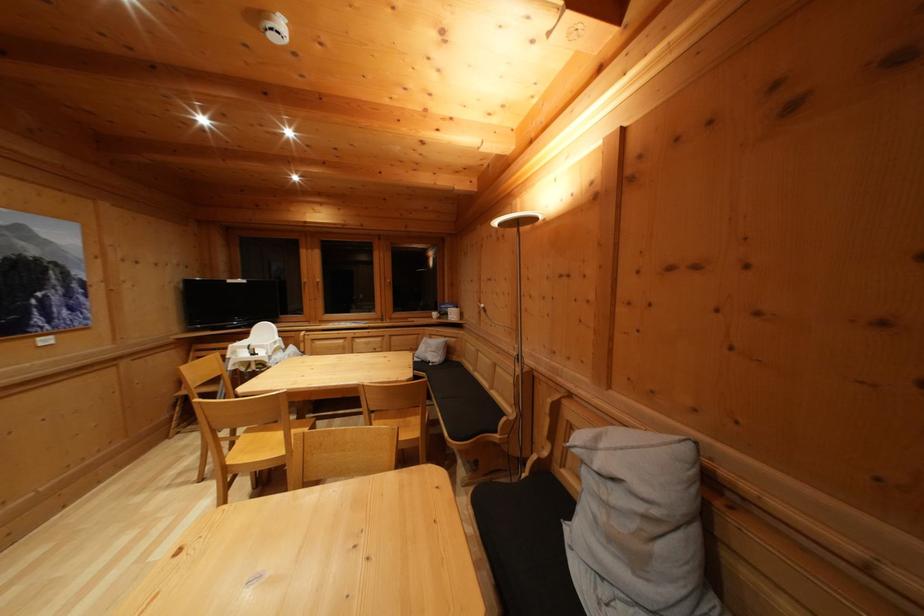
Find where to pull the window handle. Please return your answer as a coordinate pair (x, y).

(306, 286)